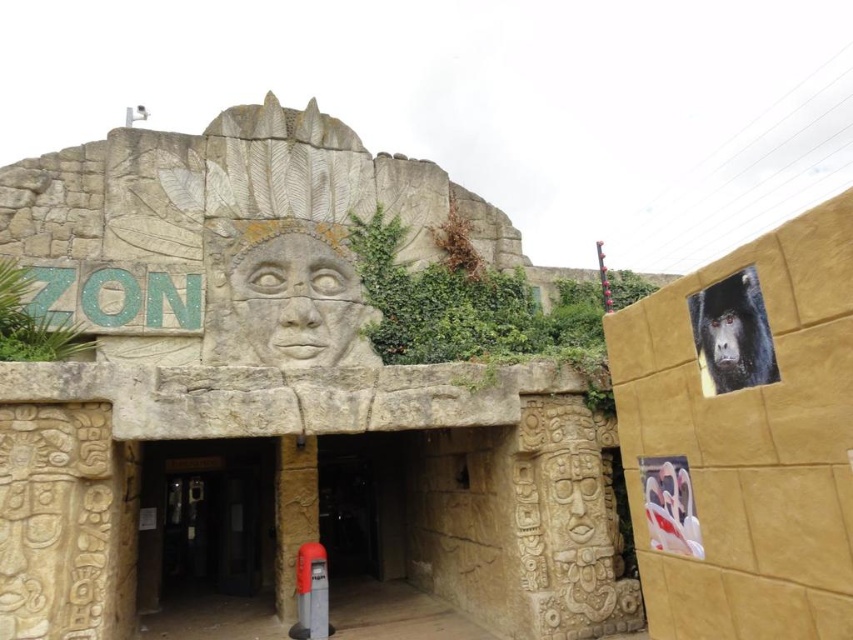
Question: Does dark brown stone entrance at center lie in front of white glossy statue at lower right?

Choices:
 (A) yes
 (B) no

Answer: (B)

Question: Is shiny black monkey at upper right to the right of white glossy statue at lower right from the viewer's perspective?

Choices:
 (A) yes
 (B) no

Answer: (A)

Question: Does rough stone face at center appear on the left side of white glossy statue at lower right?

Choices:
 (A) no
 (B) yes

Answer: (B)

Question: Which point is closer to the camera?

Choices:
 (A) (647, 496)
 (B) (160, 524)
 (C) (277, 323)
 (D) (753, 292)

Answer: (D)

Question: Which point is closer to the camera taking this photo?

Choices:
 (A) (675, 500)
 (B) (741, 273)
 (C) (294, 282)

Answer: (B)

Question: Among these objects, which one is farthest from the camera?

Choices:
 (A) rough stone face at center
 (B) shiny black monkey at upper right

Answer: (A)